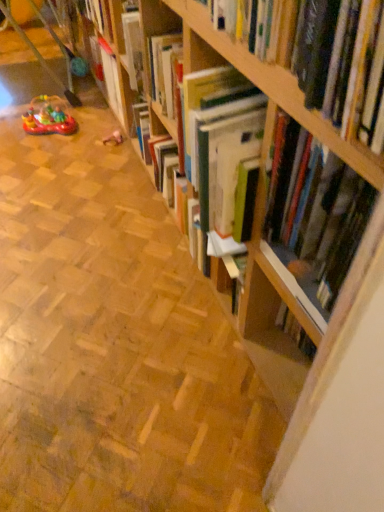
Question: Is point (104, 138) closer or farther from the camera than point (317, 243)?

Choices:
 (A) farther
 (B) closer

Answer: (A)

Question: Considering their positions, is rubberized plastic toy at center, the second toy in the left-to-right sequence, located in front of or behind hardcover book at upper right?

Choices:
 (A) behind
 (B) front

Answer: (A)

Question: Estimate the real-world distances between objects in this image. Which object is farther from the wooden bookshelf at center?

Choices:
 (A) hardcover book at upper right
 (B) rubberized plastic toy at center, the second toy in the left-to-right sequence
 (C) rubber boat at left, placed as the second toy when sorted from right to left
 (D) wooden bookcase at upper right

Answer: (B)

Question: Which object is the closest to the rubberized plastic toy at center, the second toy in the left-to-right sequence?

Choices:
 (A) wooden bookcase at upper right
 (B) wooden bookshelf at center
 (C) hardcover book at upper right
 (D) rubber boat at left, placed as the second toy when sorted from right to left

Answer: (D)